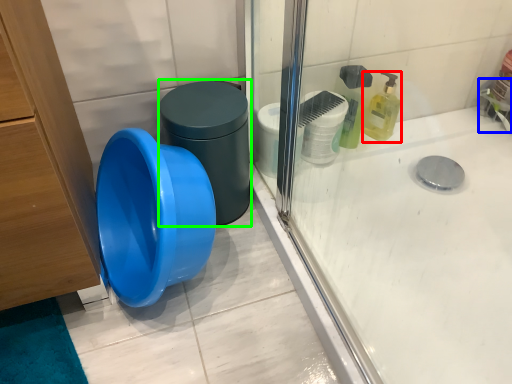
Question: Which object is the closest to the cleaning product (highlighted by a red box)? Choose among these: faucet (highlighted by a blue box) or potty (highlighted by a green box).

Choices:
 (A) faucet
 (B) potty

Answer: (A)